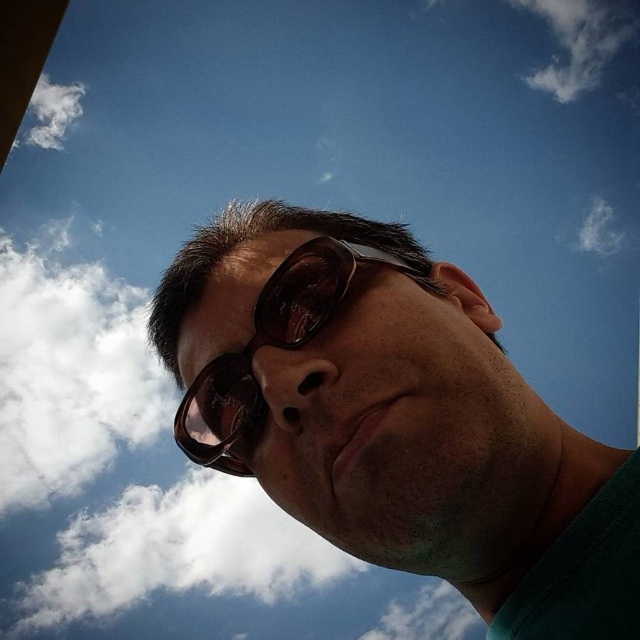
Is point (323, 520) less distant than point (65, 92)?

Yes, point (323, 520) is closer to viewer.

Is matte black sunglasses at center shorter than white fluffy cloud at upper left?

Correct, matte black sunglasses at center is not as tall as white fluffy cloud at upper left.

Is point (353, 540) behind point (76, 90)?

No, (353, 540) is closer to viewer.

Where is `matte black sunglasses at center`? The height and width of the screenshot is (640, 640). matte black sunglasses at center is located at coordinates (396, 419).

Does sunglasses at center have a greater width compared to white fluffy cloud at upper right?

No.

Based on the photo, between sunglasses at center and white fluffy cloud at upper right, which one is positioned lower?

Positioned lower is sunglasses at center.

What do you see at coordinates (269, 346) in the screenshot? This screenshot has height=640, width=640. I see `sunglasses at center` at bounding box center [269, 346].

Where is `sunglasses at center`? This screenshot has height=640, width=640. sunglasses at center is located at coordinates (269, 346).

Does sunglasses at center have a smaller size compared to white fluffy cloud at upper left?

Yes.

This screenshot has height=640, width=640. What are the coordinates of `sunglasses at center` in the screenshot? It's located at (269, 346).

The height and width of the screenshot is (640, 640). Identify the location of sunglasses at center. (269, 346).